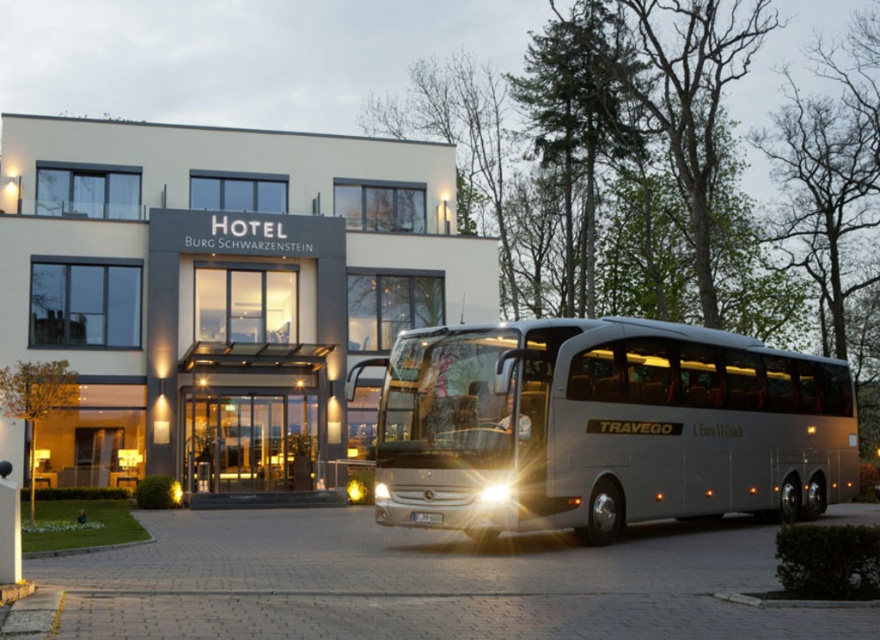
Which of these two, white matte building at center or silver metallic coach at center, stands shorter?

silver metallic coach at center

Who is taller, white matte building at center or silver metallic coach at center?

Standing taller between the two is white matte building at center.

Where is `white matte building at center`? This screenshot has width=880, height=640. white matte building at center is located at coordinates (221, 291).